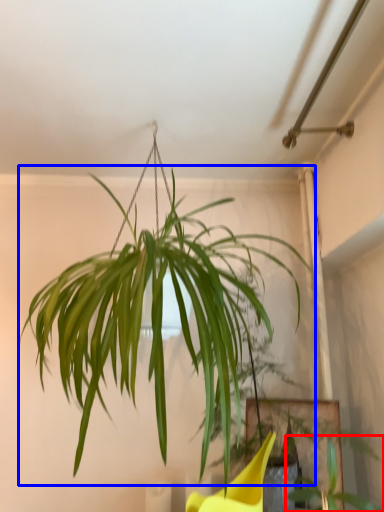
Question: Among these objects, which one is nearest to the camera, plant (highlighted by a red box) or houseplant (highlighted by a blue box)?

Choices:
 (A) plant
 (B) houseplant

Answer: (B)